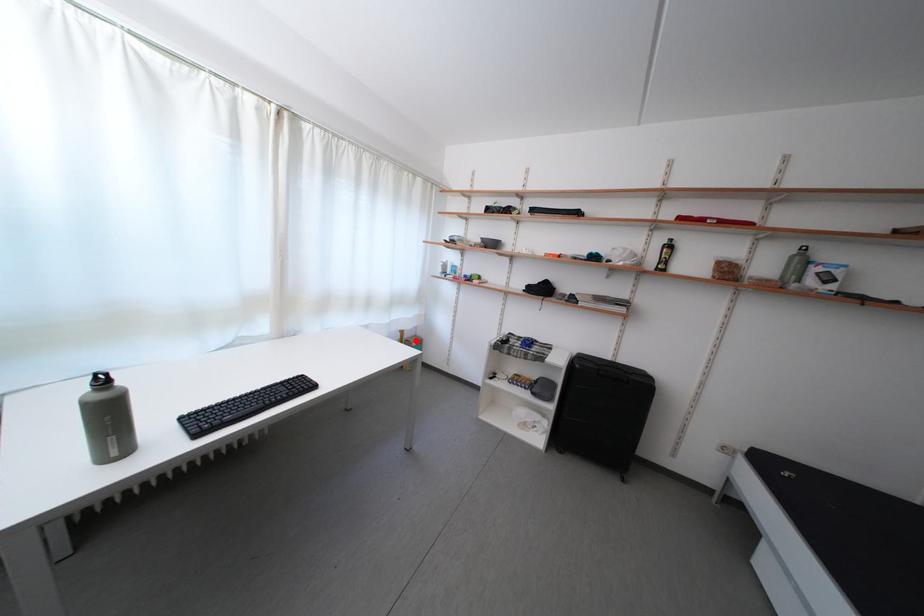
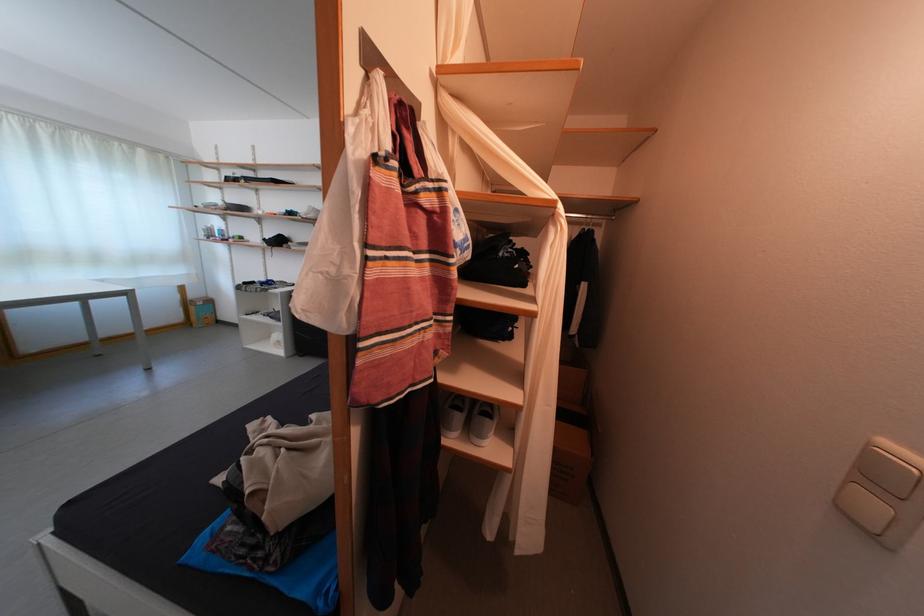
Question: I am providing you with two images of the same scene from different viewpoints. Image1 has a red point marked. In image2, the corresponding 3D location appears at what relative position? Reply with the corresponding letter.

Choices:
 (A) Closer
 (B) Farther

Answer: (A)